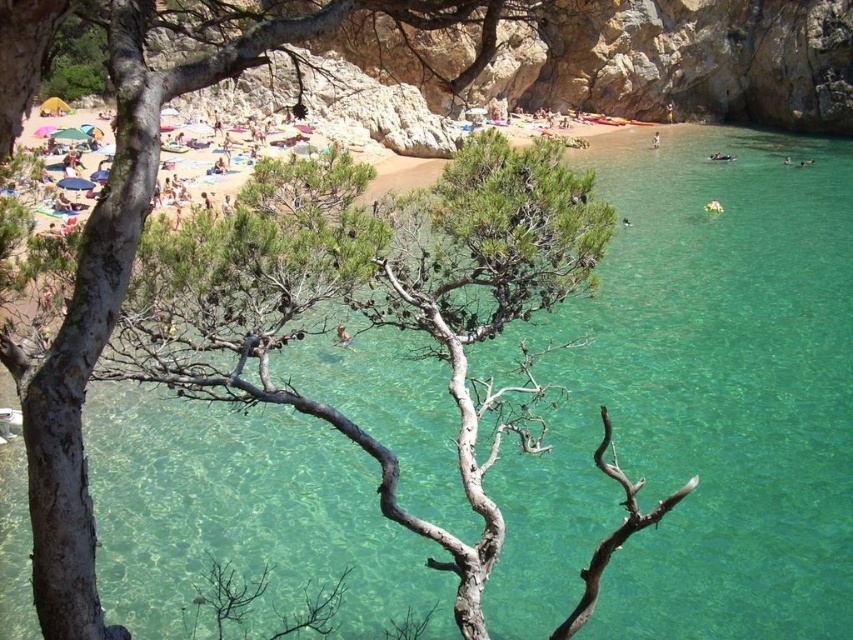
Is point (339, 332) positioned in front of point (653, 138)?

Yes, it is in front of point (653, 138).

Find the location of a particular element. The image size is (853, 640). smooth skin person at center is located at coordinates (341, 336).

Identify the location of smooth skin person at center. (341, 336).

You are a GUI agent. You are given a task and a screenshot of the screen. Output one action in this format:
    pyautogui.click(x=<x>, y=<y>)
    Task: Click on the smooth skin person at center
    
    Given the screenshot: What is the action you would take?
    pyautogui.click(x=341, y=336)

Does dark blue swimwear at lower right come in front of white fabric person at lower right?

Yes.

Does dark blue swimwear at lower right have a smaller size compared to white fabric person at lower right?

Indeed, dark blue swimwear at lower right has a smaller size compared to white fabric person at lower right.

What do you see at coordinates (721, 156) in the screenshot?
I see `dark blue swimwear at lower right` at bounding box center [721, 156].

Image resolution: width=853 pixels, height=640 pixels. Find the location of `dark blue swimwear at lower right`. dark blue swimwear at lower right is located at coordinates (721, 156).